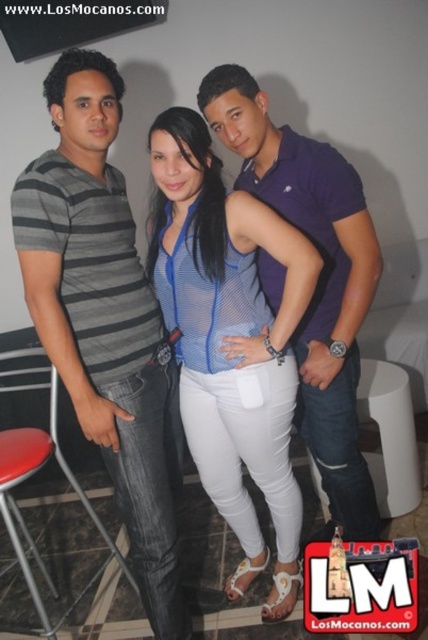
Question: Which point is farther to the camera?

Choices:
 (A) gray striped shirt at left
 (B) purple cotton polo shirt at center
 (C) red plastic stool at lower left

Answer: (B)

Question: Based on their relative distances, which object is nearer to the red plastic stool at lower left?

Choices:
 (A) gray striped shirt at left
 (B) blue mesh top at center
 (C) white plastic stool at center
 (D) purple cotton polo shirt at center

Answer: (A)

Question: Is gray striped shirt at left to the left of purple cotton polo shirt at center from the viewer's perspective?

Choices:
 (A) no
 (B) yes

Answer: (B)

Question: Is gray striped shirt at left smaller than red plastic stool at lower left?

Choices:
 (A) no
 (B) yes

Answer: (A)

Question: Which point is farther to the camera?

Choices:
 (A) blue mesh top at center
 (B) gray striped shirt at left
 (C) white plastic stool at center
 (D) purple cotton polo shirt at center

Answer: (C)

Question: Can you confirm if blue mesh top at center is wider than red plastic stool at lower left?

Choices:
 (A) yes
 (B) no

Answer: (A)